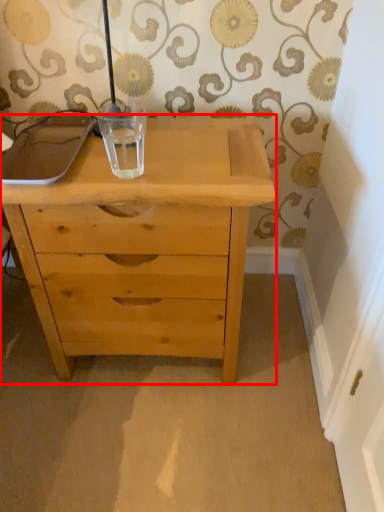
Question: Where is chest of drawers (annotated by the red box) located in relation to glass vase in the image?

Choices:
 (A) left
 (B) right

Answer: (B)